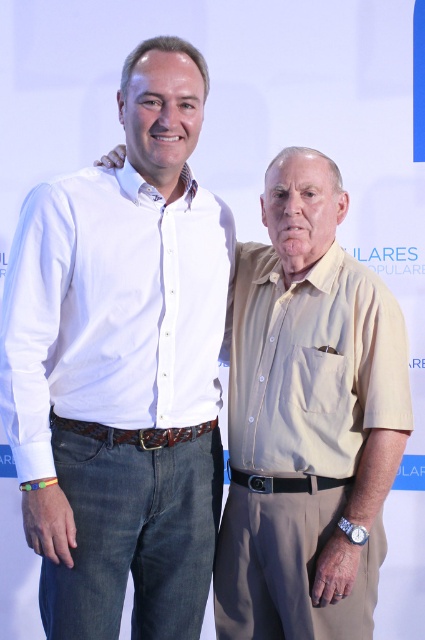
Question: Is white cotton shirt at upper left further to the viewer compared to matte khaki shirt at right?

Choices:
 (A) yes
 (B) no

Answer: (B)

Question: Is white cotton shirt at upper left bigger than matte khaki shirt at right?

Choices:
 (A) yes
 (B) no

Answer: (A)

Question: Which object is closer to the camera taking this photo?

Choices:
 (A) white cotton shirt at upper left
 (B) matte khaki shirt at right

Answer: (A)

Question: Considering the relative positions of white cotton shirt at upper left and matte khaki shirt at right in the image provided, where is white cotton shirt at upper left located with respect to matte khaki shirt at right?

Choices:
 (A) left
 (B) right

Answer: (A)

Question: Which point appears closest to the camera in this image?

Choices:
 (A) (149, 220)
 (B) (328, 273)

Answer: (A)